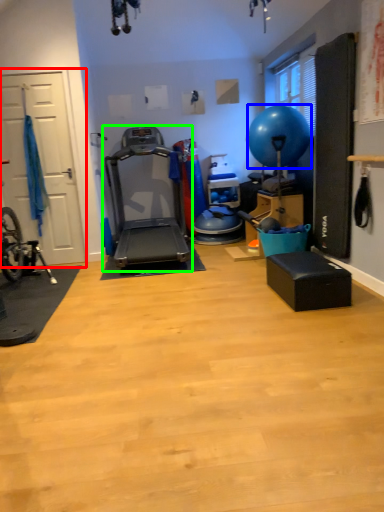
Question: Which object is the farthest from garage door (highlighted by a red box)? Choose among these: balloon (highlighted by a blue box) or treadmill (highlighted by a green box).

Choices:
 (A) balloon
 (B) treadmill

Answer: (A)